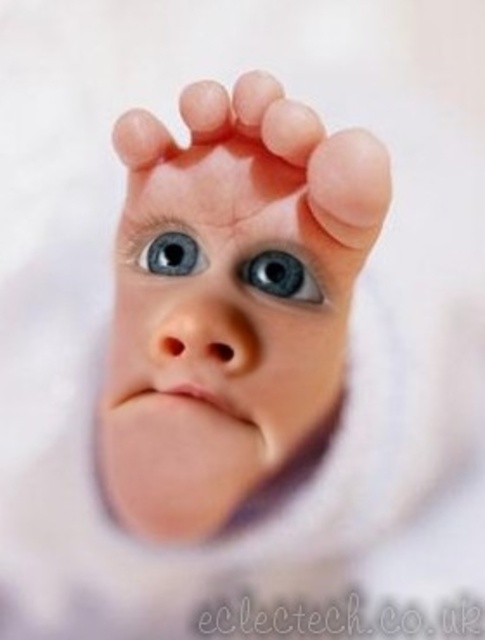
Based on the scene description, which object is taller between the smooth skin face at center and the pink smooth toe at center?

The smooth skin face at center is taller than the pink smooth toe at center according to the description.

What are the coordinates of the smooth skin face at center in the image?

The smooth skin face at center is located at point (217, 339).